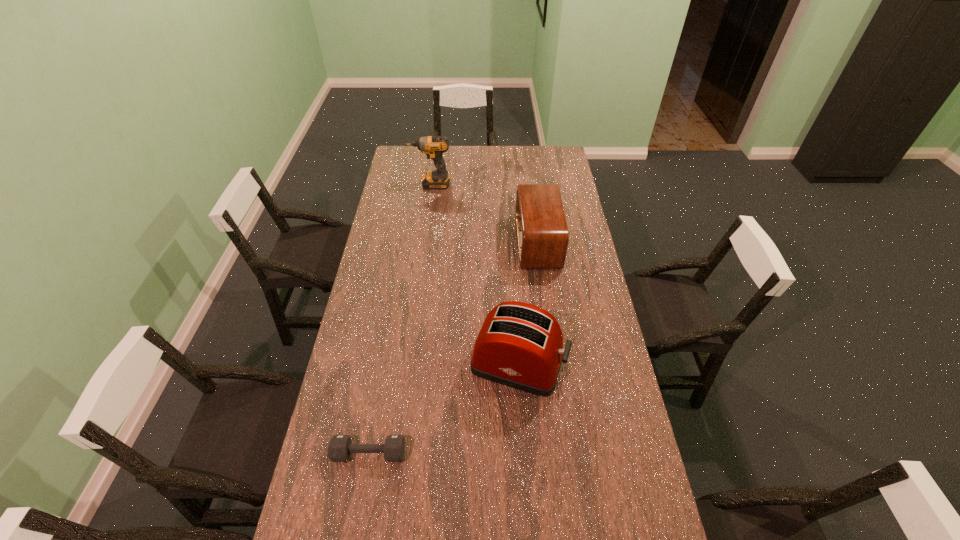
Identify the location of object that stands as the second closest to the farthest object. (520, 345).

Image resolution: width=960 pixels, height=540 pixels. Identify the location of blank area in the image that satisfies the following two spatial constraints: 1. on the back side of the toaster; 2. with the drill bit of the drill facing forward. (505, 184).

You are a GUI agent. You are given a task and a screenshot of the screen. Output one action in this format:
    pyautogui.click(x=<x>, y=<y>)
    Task: Click on the vacant area in the image that satisfies the following two spatial constraints: 1. on the back side of the third shortest object; 2. with the drill bit of the drill facing forward
    Image resolution: width=960 pixels, height=540 pixels.
    Given the screenshot: What is the action you would take?
    pyautogui.click(x=505, y=184)

The image size is (960, 540). I want to click on free space that satisfies the following two spatial constraints: 1. with the drill bit of the drill facing forward; 2. on the front side of the dumbbell, so click(x=394, y=453).

Where is `blank area in the image that satisfies the following two spatial constraints: 1. with the drill bit of the farthest object facing forward; 2. on the back side of the second tallest object`? This screenshot has width=960, height=540. blank area in the image that satisfies the following two spatial constraints: 1. with the drill bit of the farthest object facing forward; 2. on the back side of the second tallest object is located at coordinates (405, 363).

The width and height of the screenshot is (960, 540). I want to click on vacant region that satisfies the following two spatial constraints: 1. with the drill bit of the drill facing forward; 2. on the front side of the dumbbell, so click(394, 453).